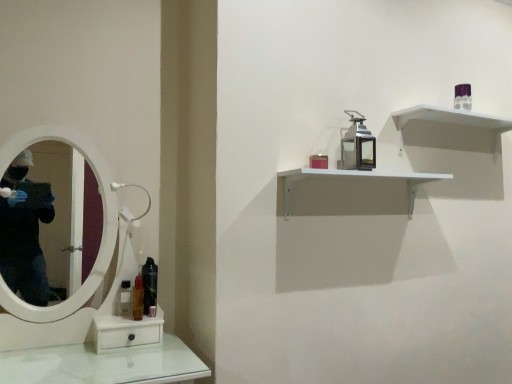
Question: Does purple glossy perfume at upper right, the 2th toiletry positioned from the bottom, appear on the right side of clear plastic bottle at lower left, which is the 3th mouthwash in right-to-left order?

Choices:
 (A) no
 (B) yes

Answer: (B)

Question: Does purple glossy perfume at upper right, arranged as the 1th toiletry when viewed from the top, have a larger size compared to clear plastic bottle at lower left, which is the 3th mouthwash in right-to-left order?

Choices:
 (A) no
 (B) yes

Answer: (B)

Question: From a real-world perspective, is purple glossy perfume at upper right, arranged as the 1th toiletry when viewed from the top, located beneath clear plastic bottle at lower left, which is the 1th mouthwash in left-to-right order?

Choices:
 (A) no
 (B) yes

Answer: (A)

Question: Is purple glossy perfume at upper right, which appears as the 2th toiletry when viewed from the left, completely or partially outside of clear plastic bottle at lower left, which is the 1th mouthwash in left-to-right order?

Choices:
 (A) no
 (B) yes

Answer: (B)

Question: Considering the relative sizes of purple glossy perfume at upper right, the 1th toiletry in the right-to-left sequence, and clear plastic bottle at lower left, which is the 3th mouthwash in right-to-left order, in the image provided, is purple glossy perfume at upper right, the 1th toiletry in the right-to-left sequence, wider than clear plastic bottle at lower left, which is the 3th mouthwash in right-to-left order,?

Choices:
 (A) no
 (B) yes

Answer: (B)

Question: Is clear plastic bottle at lower left, which is the 3th mouthwash in right-to-left order, wider or thinner than purple glossy perfume at upper right, arranged as the 1th toiletry when viewed from the top?

Choices:
 (A) wide
 (B) thin

Answer: (B)

Question: From the image's perspective, relative to purple glossy perfume at upper right, which appears as the 2th toiletry when viewed from the left, is clear plastic bottle at lower left, which is the 3th mouthwash in right-to-left order, above or below?

Choices:
 (A) below
 (B) above

Answer: (A)

Question: Considering their positions, is clear plastic bottle at lower left, which is the 1th mouthwash in left-to-right order, located in front of or behind purple glossy perfume at upper right, which appears as the 2th toiletry when viewed from the left?

Choices:
 (A) front
 (B) behind

Answer: (A)

Question: Based on their positions, is clear plastic bottle at lower left, which is the 1th mouthwash in left-to-right order, located to the left or right of purple glossy perfume at upper right, which appears as the 2th toiletry when viewed from the left?

Choices:
 (A) right
 (B) left

Answer: (B)

Question: Considering the positions of matte red candle at upper center, marked as the 1th toiletry in a left-to-right arrangement, and translucent plastic mouthwash at left, which ranks as the second mouthwash in left-to-right order, in the image, is matte red candle at upper center, marked as the 1th toiletry in a left-to-right arrangement, wider or thinner than translucent plastic mouthwash at left, which ranks as the second mouthwash in left-to-right order,?

Choices:
 (A) thin
 (B) wide

Answer: (A)

Question: In terms of size, does matte red candle at upper center, which is the 1th toiletry in bottom-to-top order, appear bigger or smaller than translucent plastic mouthwash at left, marked as the 2th mouthwash in a right-to-left arrangement?

Choices:
 (A) big
 (B) small

Answer: (B)

Question: In terms of height, does matte red candle at upper center, the 2th toiletry from the back, look taller or shorter compared to translucent plastic mouthwash at left, marked as the 2th mouthwash in a right-to-left arrangement?

Choices:
 (A) short
 (B) tall

Answer: (A)

Question: From a real-world perspective, is matte red candle at upper center, marked as the 1th toiletry in a left-to-right arrangement, positioned above or below translucent plastic mouthwash at left, marked as the 2th mouthwash in a right-to-left arrangement?

Choices:
 (A) below
 (B) above

Answer: (B)

Question: Is black glossy mouthwash at lower left, which appears as the third mouthwash when viewed from the left, situated inside purple glossy perfume at upper right, arranged as the 1th toiletry when viewed from the top, or outside?

Choices:
 (A) inside
 (B) outside

Answer: (B)

Question: Looking at their shapes, would you say black glossy mouthwash at lower left, the first mouthwash viewed from the right, is wider or thinner than purple glossy perfume at upper right, the 2th toiletry positioned from the bottom?

Choices:
 (A) thin
 (B) wide

Answer: (A)